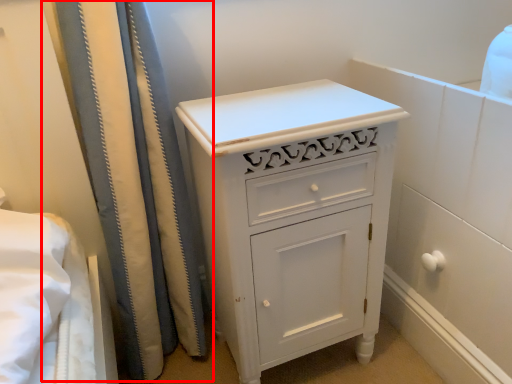
Question: Considering the relative positions of shower curtain (annotated by the red box) and chest of drawers in the image provided, where is shower curtain (annotated by the red box) located with respect to the staircase?

Choices:
 (A) right
 (B) left

Answer: (B)